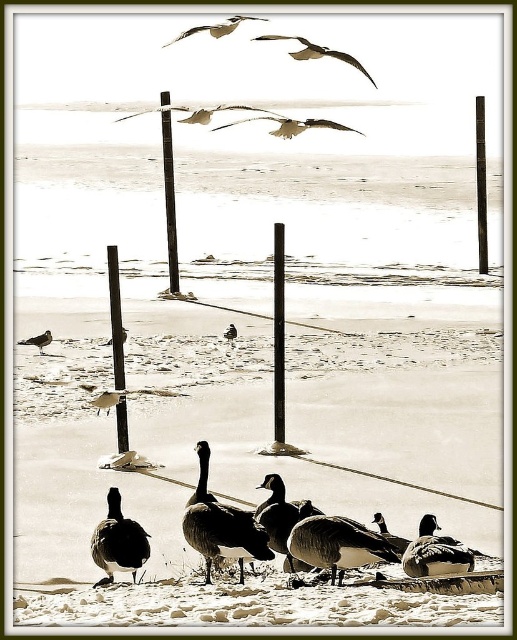
Question: Which is farther from the brown feathered duck at center?

Choices:
 (A) black wood post at center
 (B) silhouette feathered duck at lower left

Answer: (A)

Question: Which point is closer to the camera?

Choices:
 (A) brown feathered goose at lower left
 (B) black smooth pole at center

Answer: (B)

Question: Is black wood post at center behind brown feathered duck at center?

Choices:
 (A) no
 (B) yes

Answer: (B)

Question: Does brown feathered bird at upper center appear on the right side of dark brown feathers at center?

Choices:
 (A) yes
 (B) no

Answer: (A)

Question: Which is farther from the brown feathered goose at lower left?

Choices:
 (A) gray downy duck at lower right
 (B) brown feathered bird at center
 (C) brown feathered bird at upper center
 (D) black smooth pole at right

Answer: (D)

Question: Is brown feathered duck at center thinner than black wood post at center-left?

Choices:
 (A) no
 (B) yes

Answer: (A)